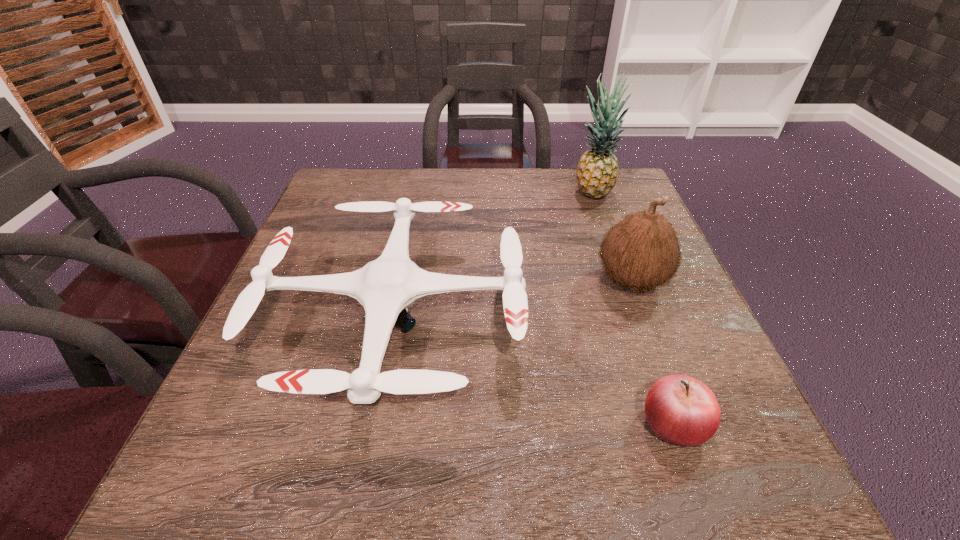
Where is `vacant region located 0.330m with the camera attached at the bottom of the drone`? The width and height of the screenshot is (960, 540). vacant region located 0.330m with the camera attached at the bottom of the drone is located at coordinates (690, 319).

You are a GUI agent. You are given a task and a screenshot of the screen. Output one action in this format:
    pyautogui.click(x=<x>, y=<y>)
    Task: Click on the vacant space located on the left of the shortest object
    This screenshot has height=540, width=960.
    Given the screenshot: What is the action you would take?
    pyautogui.click(x=407, y=423)

Find the location of a particular element. The image size is (960, 540). object present at the far edge is located at coordinates (597, 171).

The height and width of the screenshot is (540, 960). Identify the location of object positioned at the near edge. (682, 410).

The width and height of the screenshot is (960, 540). I want to click on object that is at the left edge, so click(385, 287).

The image size is (960, 540). Find the location of `pineapple that is at the right edge`. pineapple that is at the right edge is located at coordinates (597, 171).

Identify the location of coconut present at the right edge. The height and width of the screenshot is (540, 960). (642, 251).

The image size is (960, 540). What are the coordinates of `apple that is at the right edge` in the screenshot? It's located at point(682,410).

Find the location of `object present at the far right corner`. object present at the far right corner is located at coordinates (597, 171).

You are a GUI agent. You are given a task and a screenshot of the screen. Output one action in this format:
    pyautogui.click(x=<x>, y=<y>)
    Task: Click on the object that is at the near right corner
    
    Given the screenshot: What is the action you would take?
    pyautogui.click(x=682, y=410)